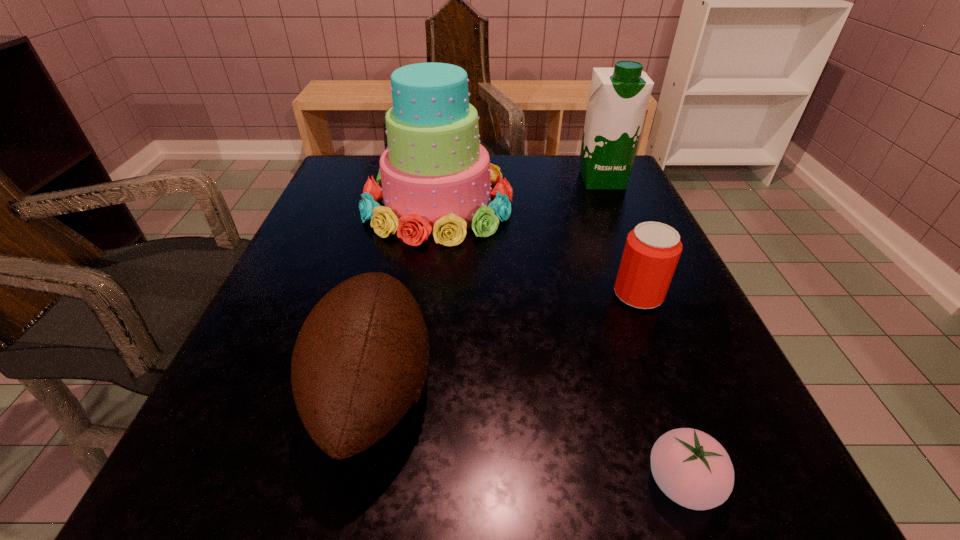
Find the location of a particular element. This screenshot has height=540, width=960. object located in the far left corner section of the desktop is located at coordinates (435, 178).

Find the location of `object present at the near left corner`. object present at the near left corner is located at coordinates (360, 360).

At what (x,y) coordinates should I click in order to perform the action: click on object that is positioned at the far right corner. Please return your answer as a coordinate pair (x, y). This screenshot has height=540, width=960. Looking at the image, I should click on (618, 97).

You are a GUI agent. You are given a task and a screenshot of the screen. Output one action in this format:
    pyautogui.click(x=<x>, y=<y>)
    Task: Click on the object that is at the near right corner
    Image resolution: width=960 pixels, height=540 pixels.
    Given the screenshot: What is the action you would take?
    pyautogui.click(x=693, y=469)

Locate an element on the screen. This screenshot has width=960, height=540. vacant point at the far edge is located at coordinates (522, 171).

In the image, there is a desktop. Where is `vacant space at the near edge`? This screenshot has width=960, height=540. vacant space at the near edge is located at coordinates (382, 514).

Locate an element on the screen. This screenshot has width=960, height=540. free spot at the left edge of the desktop is located at coordinates (274, 315).

Locate an element on the screen. vacant space at the right edge of the desktop is located at coordinates (614, 294).

Image resolution: width=960 pixels, height=540 pixels. I want to click on vacant space at the far left corner of the desktop, so click(351, 188).

Where is `vacant space at the far right corner`? The image size is (960, 540). vacant space at the far right corner is located at coordinates (572, 163).